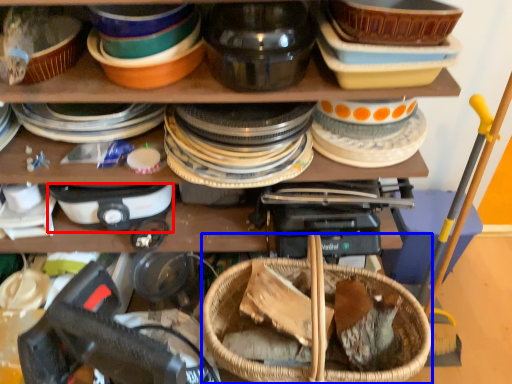
Question: Which object is closer to the camera taking this photo, appliance (highlighted by a red box) or basket (highlighted by a blue box)?

Choices:
 (A) appliance
 (B) basket

Answer: (B)